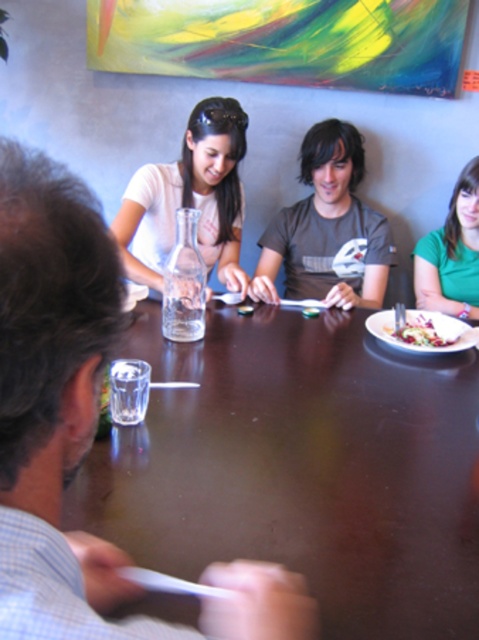
Question: Which object is closer to the camera taking this photo?

Choices:
 (A) matte white shirt at upper left
 (B) smooth dark wood table at center
 (C) dark gray t-shirt at center
 (D) white matte plate at right

Answer: (B)

Question: Which object appears closest to the camera in this image?

Choices:
 (A) matte white shirt at upper left
 (B) salad with mixed greens and dressing at lower right
 (C) green matte shirt at upper right

Answer: (B)

Question: Is dark gray t-shirt at center above matte white shirt at upper left?

Choices:
 (A) yes
 (B) no

Answer: (B)

Question: Is dark gray t-shirt at center wider than salad with mixed greens and dressing at lower right?

Choices:
 (A) yes
 (B) no

Answer: (A)

Question: Which point is farther from the camera taking this photo?

Choices:
 (A) (117, 538)
 (B) (446, 291)
 (C) (413, 321)

Answer: (B)

Question: Is matte white shirt at upper left wider than green matte shirt at upper right?

Choices:
 (A) no
 (B) yes

Answer: (B)